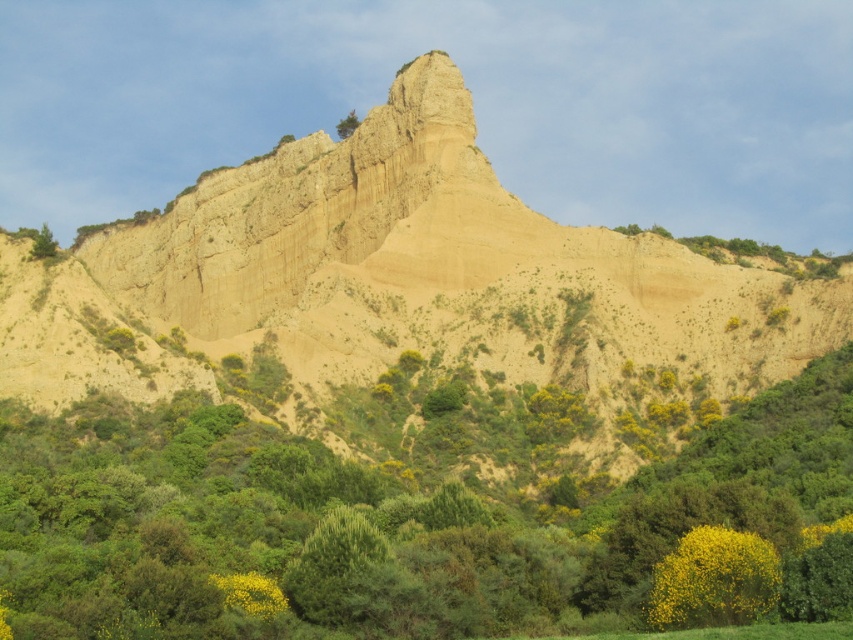
Question: Can you confirm if yellow leafy bush at lower right is thinner than green leafy tree at upper center?

Choices:
 (A) no
 (B) yes

Answer: (B)

Question: Does yellow leafy bush at lower right have a smaller size compared to green leafy tree at upper left?

Choices:
 (A) yes
 (B) no

Answer: (A)

Question: Does green leafy shrub at center appear over yellow leafy bush at lower right?

Choices:
 (A) yes
 (B) no

Answer: (A)

Question: Which point is farther to the camera?

Choices:
 (A) green leafy tree at upper center
 (B) yellow leafy bush at lower right
 (C) green leafy shrub at center

Answer: (A)

Question: Which object is the farthest from the green leafy tree at upper center?

Choices:
 (A) earthy sandstone cliff at center
 (B) yellow leafy bush at lower right
 (C) green leafy shrub at center

Answer: (B)

Question: Which point is farther to the camera?

Choices:
 (A) earthy sandstone cliff at center
 (B) green leafy shrub at center
 (C) yellow leafy bush at lower right

Answer: (A)